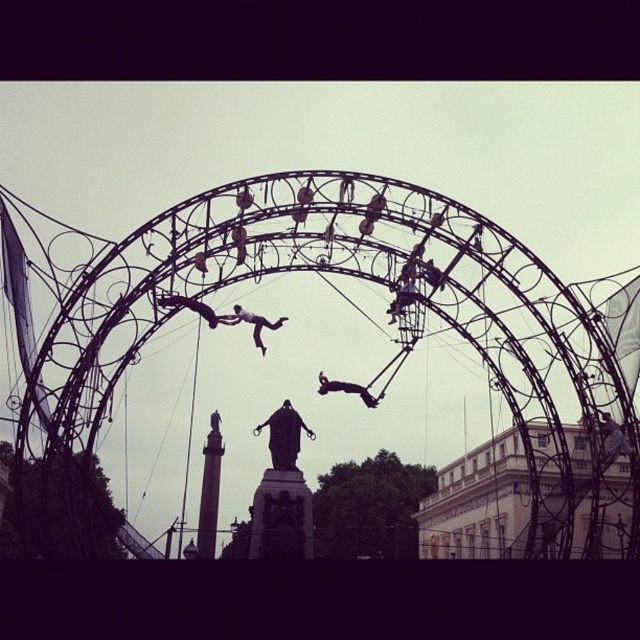
Is point (144, 365) positioned after point (320, 388)?

Yes.

Measure the distance between point (40, 268) and camera.

They are 140.45 meters apart.

Locate an element on the screen. The image size is (640, 640). black wireframe amusement park at center is located at coordinates (340, 356).

In the scene shown: Is metallic silver statue at center shorter than metallic wire figure at center?

No, metallic silver statue at center is not shorter than metallic wire figure at center.

Between point (612, 422) and point (412, 301), which one is positioned behind?

The point (612, 422) is behind.

At what (x,y) coordinates should I click in order to perform the action: click on metallic silver statue at center. Please return your answer as a coordinate pair (x, y). This screenshot has height=640, width=640. Looking at the image, I should click on (612, 440).

Based on the photo, is polished bronze statue at center taller than black matte person at center?

Yes, polished bronze statue at center is taller than black matte person at center.

Looking at this image, can you confirm if polished bronze statue at center is positioned to the right of black matte person at center?

Incorrect, polished bronze statue at center is not on the right side of black matte person at center.

Where is `polished bronze statue at center`? Image resolution: width=640 pixels, height=640 pixels. polished bronze statue at center is located at coordinates (284, 435).

I want to click on polished bronze statue at center, so click(x=284, y=435).